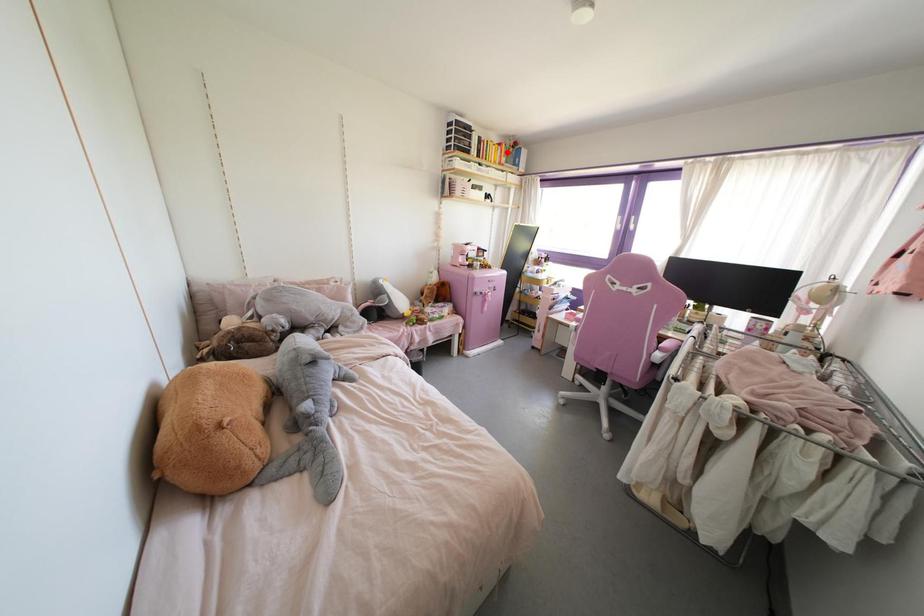
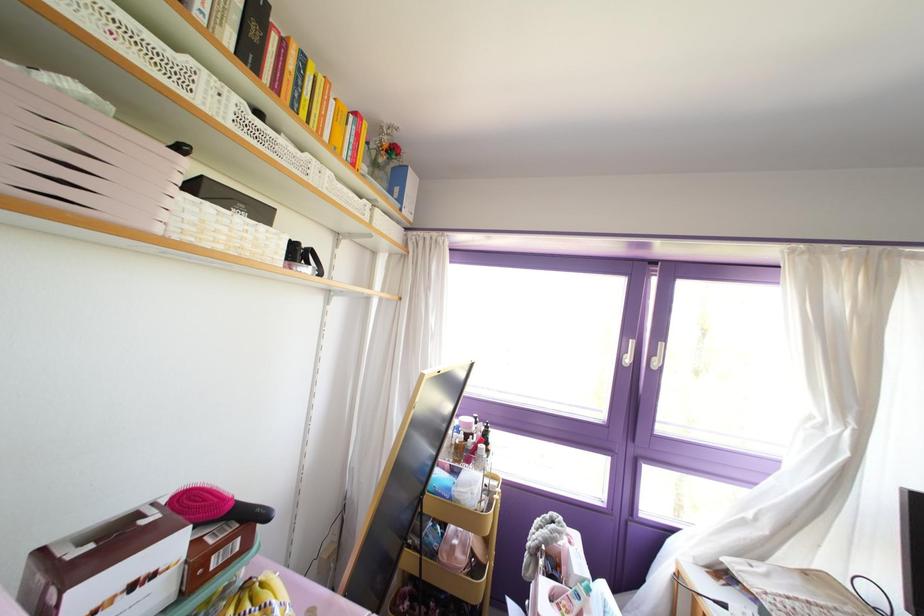
Question: I am providing you with two images of the same scene from different viewpoints. Image1 has a red point marked. In image2, the corresponding 3D location appears at what relative position? Reply with the corresponding letter.

Choices:
 (A) Closer
 (B) Farther

Answer: (B)